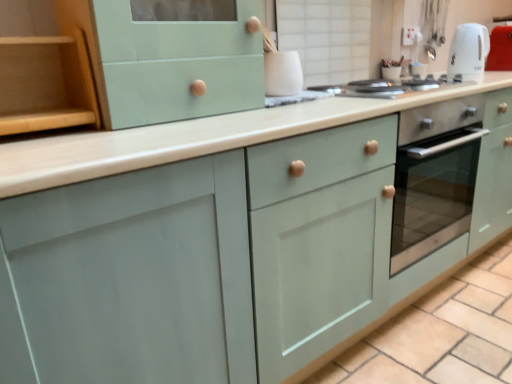
Question: Is wooden shelf at left completely or partially inside white glossy kettle at upper center, the 2th appliance in the top-to-bottom sequence?

Choices:
 (A) no
 (B) yes

Answer: (A)

Question: Does white glossy kettle at upper center, the 2th appliance in the top-to-bottom sequence, have a greater height compared to wooden shelf at left?

Choices:
 (A) yes
 (B) no

Answer: (B)

Question: Is white glossy kettle at upper center, the first appliance in the left-to-right sequence, touching wooden shelf at left?

Choices:
 (A) no
 (B) yes

Answer: (A)

Question: Are white glossy kettle at upper center, positioned as the second appliance in back-to-front order, and wooden shelf at left located far from each other?

Choices:
 (A) no
 (B) yes

Answer: (A)

Question: Considering the relative positions of white glossy kettle at upper center, acting as the 2th appliance starting from the right, and wooden shelf at left in the image provided, is white glossy kettle at upper center, acting as the 2th appliance starting from the right, to the left of wooden shelf at left from the viewer's perspective?

Choices:
 (A) yes
 (B) no

Answer: (B)

Question: Considering the relative sizes of white glossy kettle at upper center, the 2th appliance in the top-to-bottom sequence, and wooden shelf at left in the image provided, is white glossy kettle at upper center, the 2th appliance in the top-to-bottom sequence, wider than wooden shelf at left?

Choices:
 (A) yes
 (B) no

Answer: (B)

Question: From the image's perspective, is white glossy electric kettle at upper right located above matte green cabinet at center?

Choices:
 (A) yes
 (B) no

Answer: (A)

Question: From a real-world perspective, is white glossy electric kettle at upper right physically below matte green cabinet at center?

Choices:
 (A) yes
 (B) no

Answer: (B)

Question: Does white glossy electric kettle at upper right appear on the right side of matte green cabinet at center?

Choices:
 (A) no
 (B) yes

Answer: (B)

Question: Can you confirm if white glossy electric kettle at upper right is wider than matte green cabinet at center?

Choices:
 (A) yes
 (B) no

Answer: (B)

Question: Is white glossy electric kettle at upper right completely or partially outside of matte green cabinet at center?

Choices:
 (A) no
 (B) yes

Answer: (B)

Question: Does white glossy electric kettle at upper right have a greater height compared to matte green cabinet at center?

Choices:
 (A) no
 (B) yes

Answer: (B)

Question: Is white glossy electric kettle at upper right oriented towards white glossy kettle at upper center, the first appliance from the bottom?

Choices:
 (A) no
 (B) yes

Answer: (A)